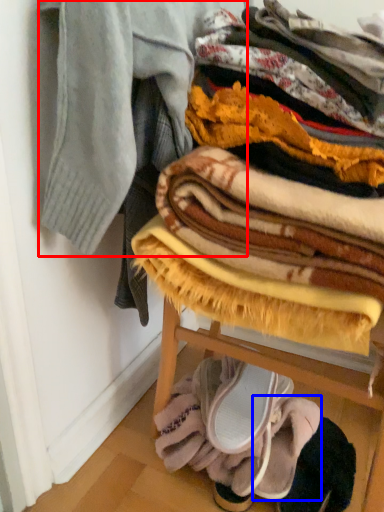
Question: Which object is further to the camera taking this photo, garment (highlighted by a red box) or footwear (highlighted by a blue box)?

Choices:
 (A) garment
 (B) footwear

Answer: (B)